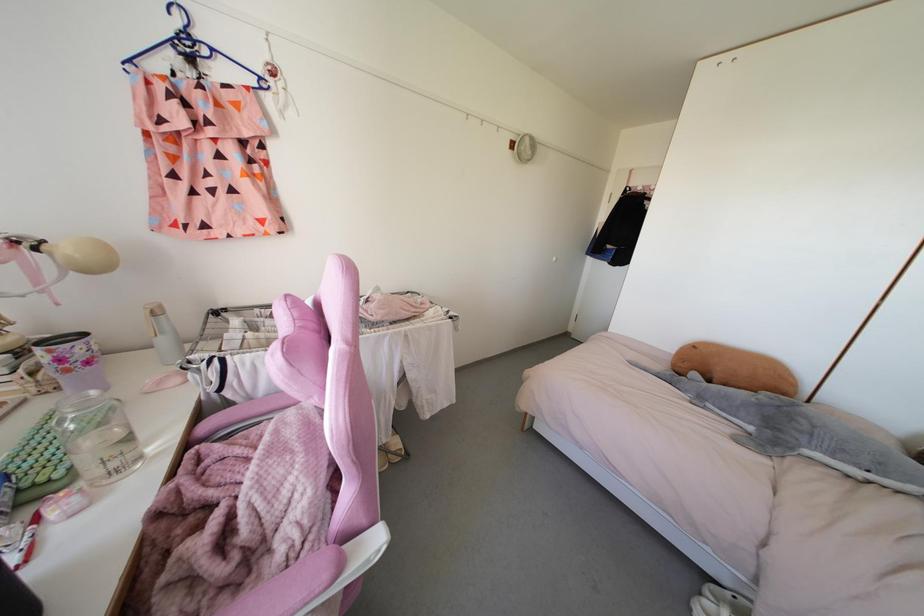
Find where to lift the brown stuffed animal. Please return your answer as a coordinate pair (x, y).

(735, 368)